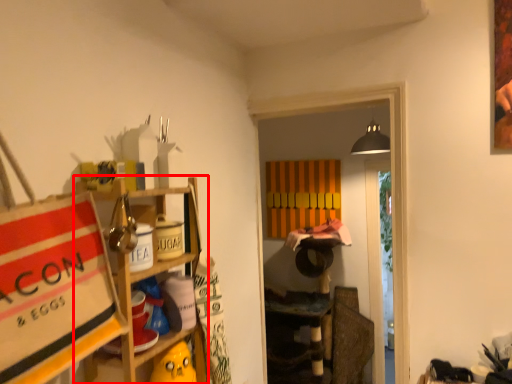
Question: From the image's perspective, considering the relative positions of shelf (annotated by the red box) and cabinet in the image provided, where is shelf (annotated by the red box) located with respect to the staircase?

Choices:
 (A) above
 (B) below

Answer: (B)